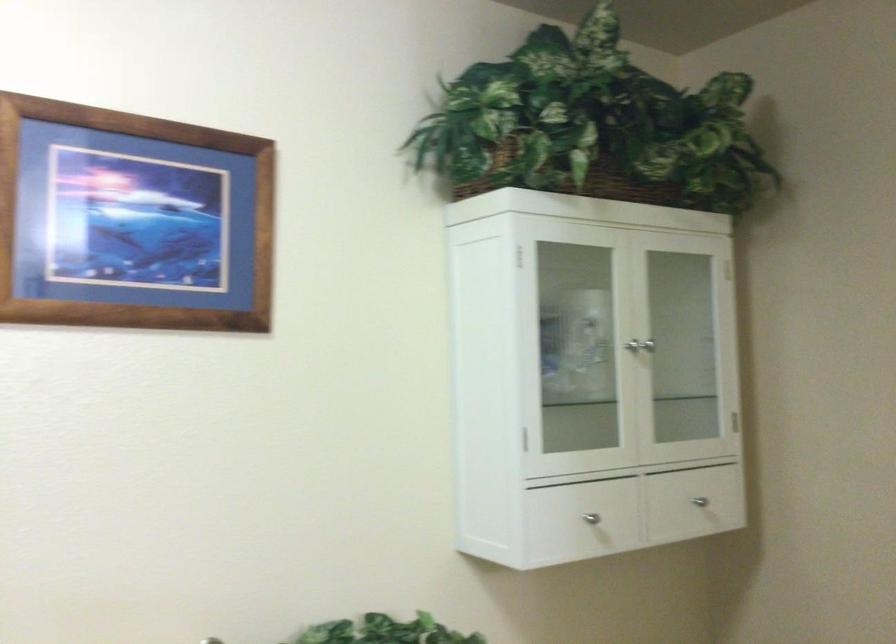
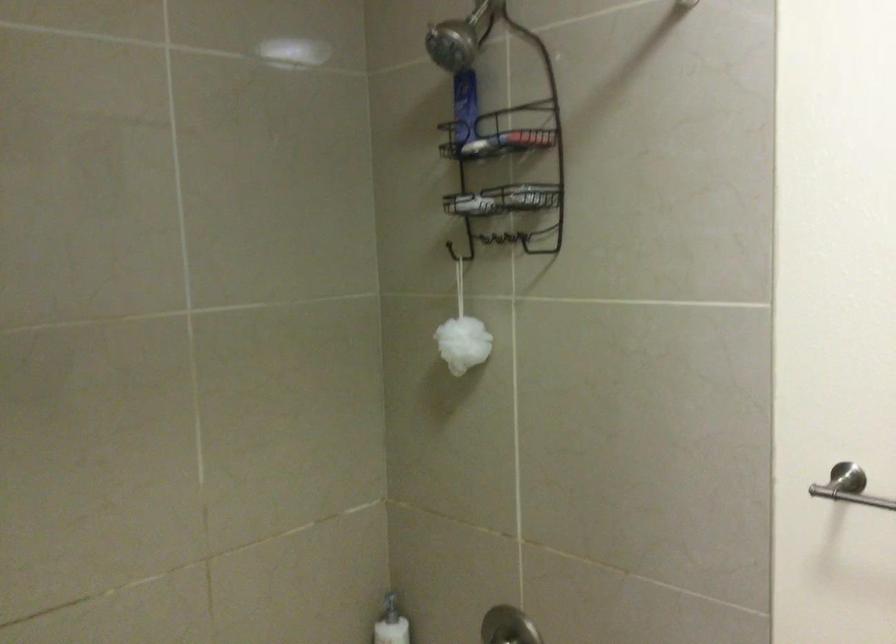
Question: Based on the continuous images, in which direction is the camera rotating? Reply with the corresponding letter.

Choices:
 (A) Left
 (B) Right
 (C) Up
 (D) Down

Answer: (A)